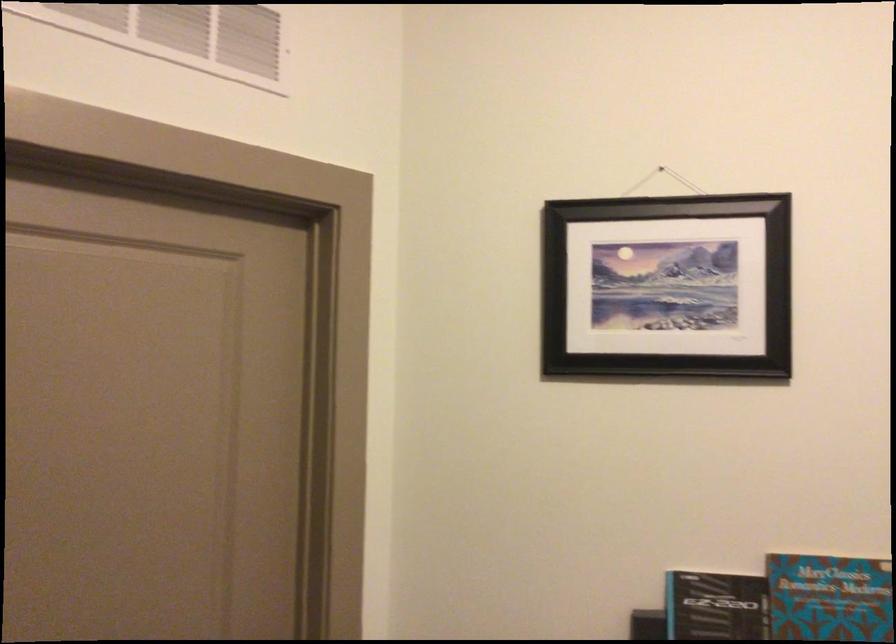
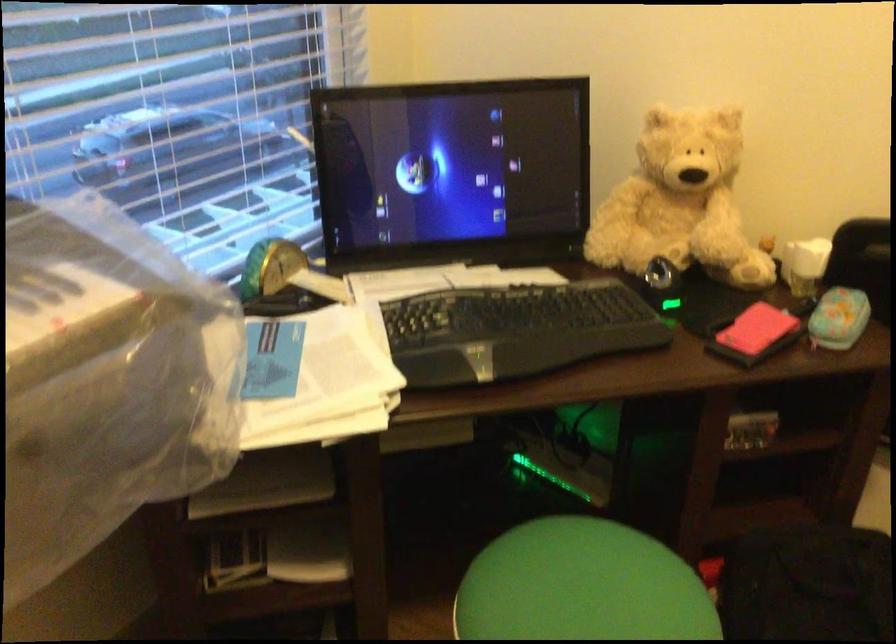
How did the camera likely rotate?

The camera's rotation is toward right-down.